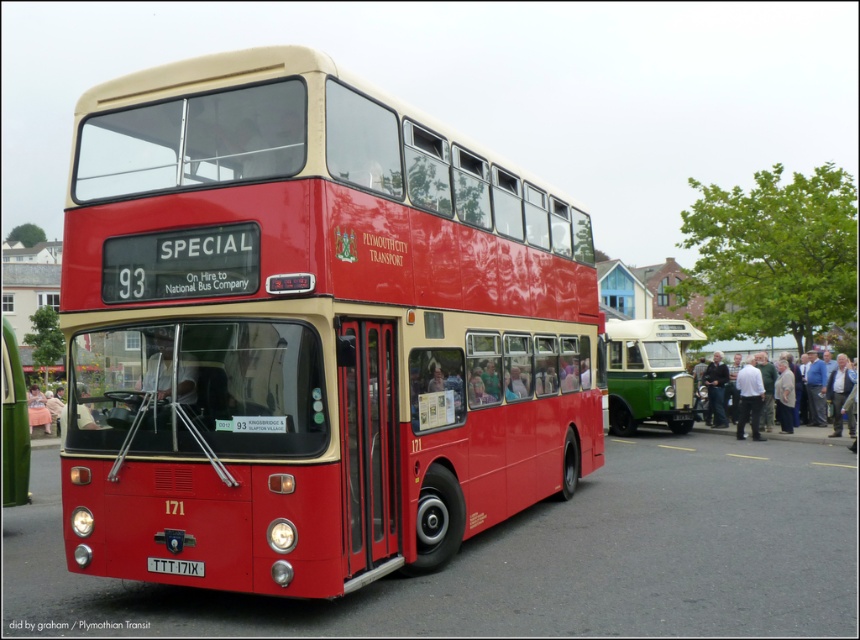
You are a GUI agent. You are given a task and a screenshot of the screen. Output one action in this format:
    pyautogui.click(x=<x>, y=<y>)
    Task: Click on the matte red bus at center
    This screenshot has width=860, height=640.
    Given the screenshot: What is the action you would take?
    pyautogui.click(x=310, y=330)

Is point (235, 513) positioned before point (610, 339)?

Yes, it is in front of point (610, 339).

The image size is (860, 640). Identify the location of matte red bus at center. (310, 330).

This screenshot has height=640, width=860. What do you see at coordinates (649, 372) in the screenshot?
I see `green polished wood bus at center` at bounding box center [649, 372].

Who is positioned more to the right, green polished wood bus at center or red plastic license plate at center?

green polished wood bus at center

Is point (664, 326) less distant than point (163, 572)?

No, it is behind (163, 572).

The height and width of the screenshot is (640, 860). What are the coordinates of `green polished wood bus at center` in the screenshot? It's located at (649, 372).

Who is more distant from viewer, (x=486, y=301) or (x=197, y=563)?

Point (x=486, y=301)

What are the coordinates of `matte red bus at center` in the screenshot? It's located at (310, 330).

Find the location of a particular element. Image resolution: width=860 pixels, height=640 pixels. matte red bus at center is located at coordinates (310, 330).

At what (x,y) coordinates should I click in order to perform the action: click on matte red bus at center. Please return your answer as a coordinate pair (x, y). The width and height of the screenshot is (860, 640). Looking at the image, I should click on (310, 330).